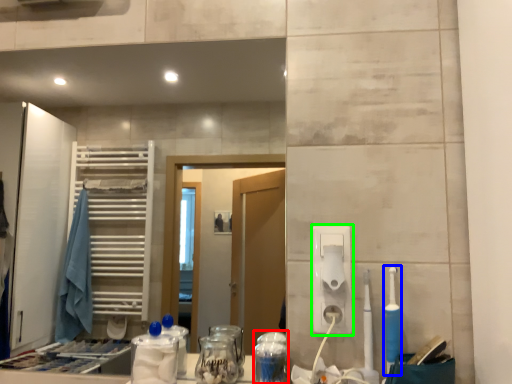
Question: Which object is the closest to the glass jar (highlighted by a red box)? Choose among these: toothbrush (highlighted by a blue box) or hand dryer (highlighted by a green box).

Choices:
 (A) toothbrush
 (B) hand dryer

Answer: (B)